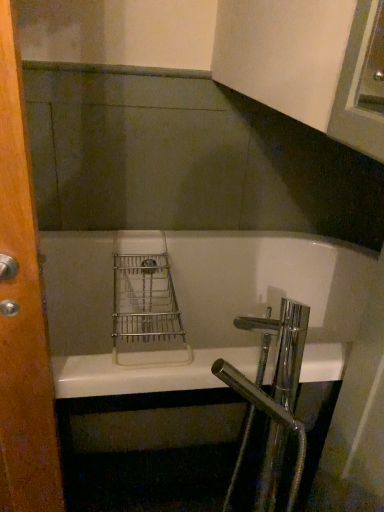
Question: Would you say white glossy bathtub at center is part of chrome/metallic faucet at lower right's contents?

Choices:
 (A) no
 (B) yes

Answer: (A)

Question: Considering the relative positions of chrome/metallic faucet at lower right and white glossy bathtub at center in the image provided, is chrome/metallic faucet at lower right to the right of white glossy bathtub at center from the viewer's perspective?

Choices:
 (A) no
 (B) yes

Answer: (B)

Question: Considering the relative sizes of chrome/metallic faucet at lower right and white glossy bathtub at center in the image provided, is chrome/metallic faucet at lower right thinner than white glossy bathtub at center?

Choices:
 (A) no
 (B) yes

Answer: (B)

Question: Can we say chrome/metallic faucet at lower right lies outside white glossy bathtub at center?

Choices:
 (A) no
 (B) yes

Answer: (B)

Question: From a real-world perspective, does chrome/metallic faucet at lower right sit lower than white glossy bathtub at center?

Choices:
 (A) no
 (B) yes

Answer: (A)

Question: Considering the relative positions of chrome/metallic faucet at lower right and white glossy bathtub at center in the image provided, is chrome/metallic faucet at lower right in front of white glossy bathtub at center?

Choices:
 (A) no
 (B) yes

Answer: (B)

Question: Is white glossy bathtub at center thinner than chrome/metallic faucet at lower right?

Choices:
 (A) yes
 (B) no

Answer: (B)

Question: Does white glossy bathtub at center appear on the right side of chrome/metallic faucet at lower right?

Choices:
 (A) yes
 (B) no

Answer: (B)

Question: From a real-world perspective, is white glossy bathtub at center located higher than chrome/metallic faucet at lower right?

Choices:
 (A) no
 (B) yes

Answer: (A)

Question: Does white glossy bathtub at center have a greater height compared to chrome/metallic faucet at lower right?

Choices:
 (A) yes
 (B) no

Answer: (B)

Question: From the image's perspective, does white glossy bathtub at center appear lower than chrome/metallic faucet at lower right?

Choices:
 (A) no
 (B) yes

Answer: (A)

Question: Can you confirm if white glossy bathtub at center is positioned to the left of chrome/metallic faucet at lower right?

Choices:
 (A) no
 (B) yes

Answer: (B)

Question: From the image's perspective, is wooden door at left below chrome/metallic faucet at lower right?

Choices:
 (A) no
 (B) yes

Answer: (A)